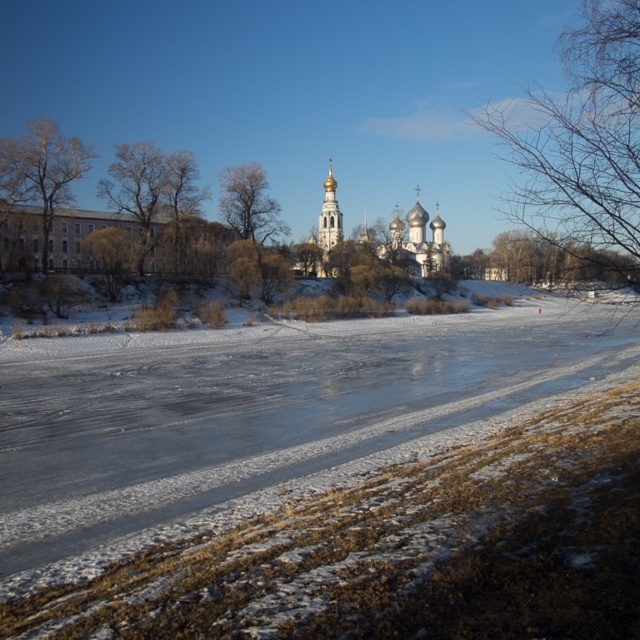
Does bare branches at upper right appear under brown textured tree at left?

No, bare branches at upper right is not below brown textured tree at left.

Which is more to the left, bare branches at upper right or brown textured tree at left?

brown textured tree at left

Is point (541, 144) farther from camera compared to point (88, 243)?

That is False.

Locate an element on the screen. The image size is (640, 640). bare branches at upper right is located at coordinates (580, 138).

Is bare branches at upper right wider than golden domed church at center?

Yes, bare branches at upper right is wider than golden domed church at center.

Image resolution: width=640 pixels, height=640 pixels. Describe the element at coordinates (580, 138) in the screenshot. I see `bare branches at upper right` at that location.

You are a GUI agent. You are given a task and a screenshot of the screen. Output one action in this format:
    pyautogui.click(x=<x>, y=<y>)
    Task: Click on the bare branches at upper right
    
    Given the screenshot: What is the action you would take?
    (580, 138)

Is point (582, 120) farther from camera compared to point (276, 216)?

No.

Locate an element on the screen. bare branches at upper right is located at coordinates (580, 138).